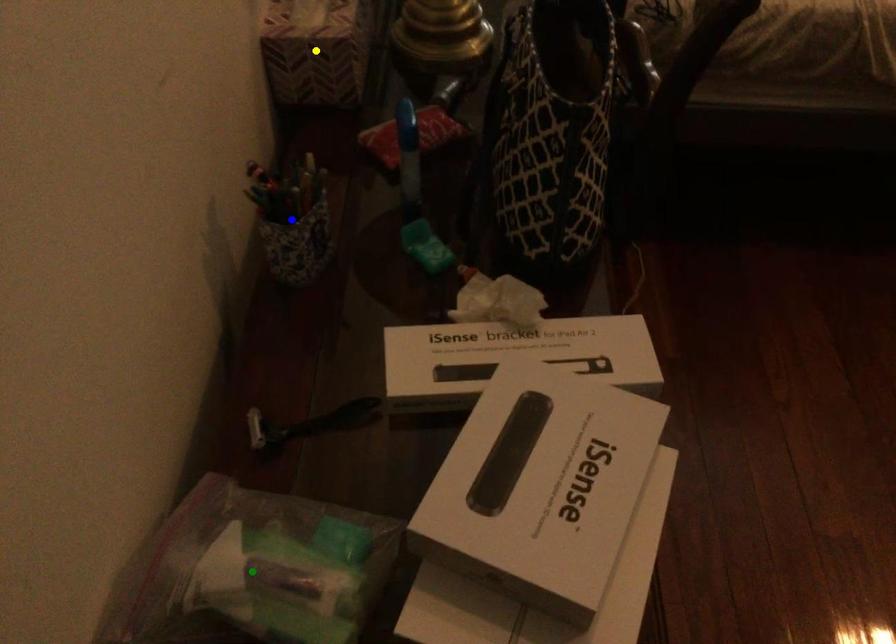
Order these from farthest to nearest:
- yellow point
- green point
- blue point

yellow point → blue point → green point